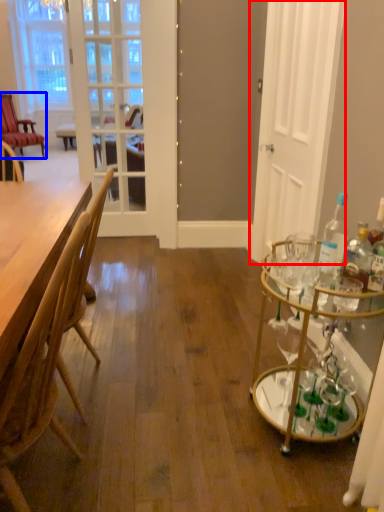
Question: Which object is further to the camera taking this photo, door (highlighted by a red box) or chair (highlighted by a blue box)?

Choices:
 (A) door
 (B) chair

Answer: (B)